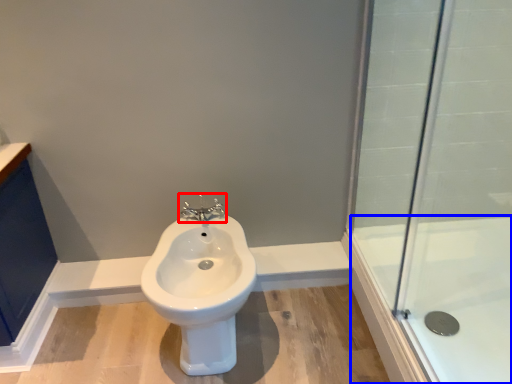
Question: Which object is further to the camera taking this photo, tap (highlighted by a red box) or bath (highlighted by a blue box)?

Choices:
 (A) tap
 (B) bath

Answer: (A)